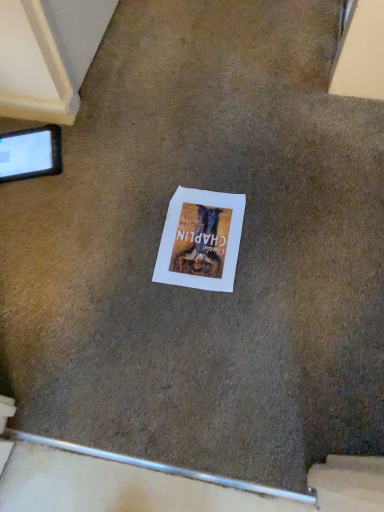
The image size is (384, 512). Find the location of `free space above black glossy tablet at upper left (from a real-world perspective)`. free space above black glossy tablet at upper left (from a real-world perspective) is located at coordinates (20, 147).